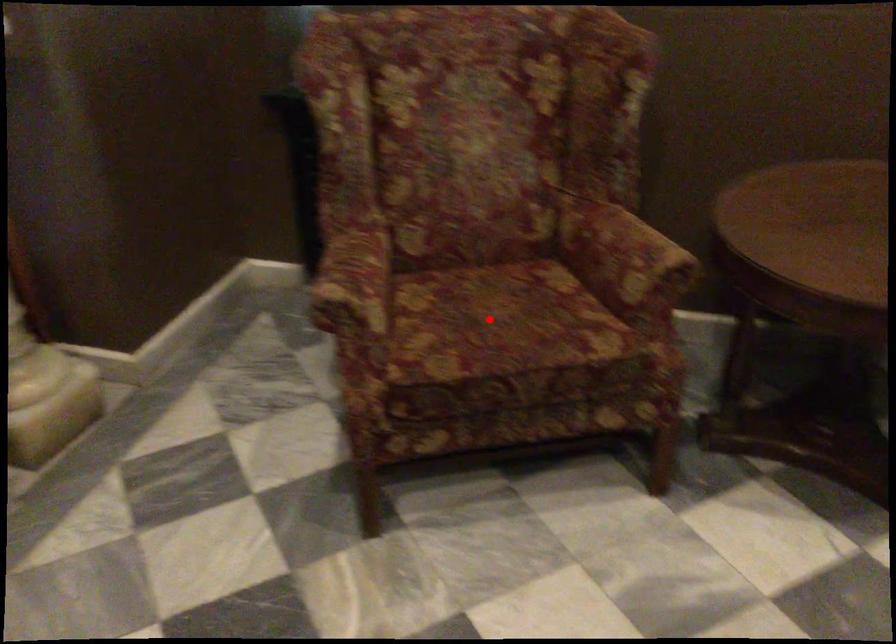
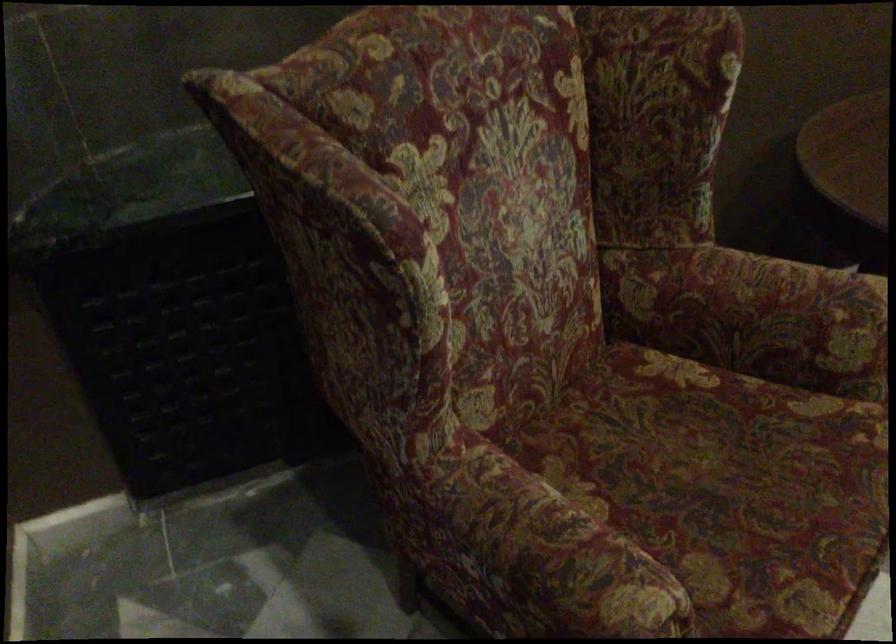
Question: A red point is marked in image1. In image2, is the corresponding 3D point closer to the camera or farther? Reply with the corresponding letter.

Choices:
 (A) The corresponding 3D point is closer.
 (B) The corresponding 3D point is farther.

Answer: (A)